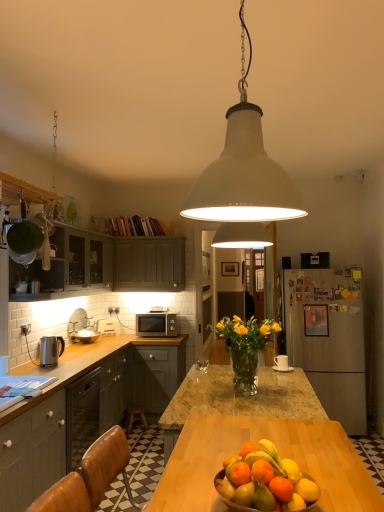
What is the approximate width of matte gray cabinets at left, which is the first cabinetry in bottom-to-top order?

25.11 inches.

This screenshot has width=384, height=512. What do you see at coordinates (32, 453) in the screenshot?
I see `matte gray cabinets at left, the fourth cabinetry positioned from the top` at bounding box center [32, 453].

Describe the element at coordinates (149, 264) in the screenshot. I see `matte gray cabinet at center, the second cabinetry when ordered from top to bottom` at that location.

Where is `orange matte citrus at center, which is counted as the 1th citrus fruit, starting from the back`? orange matte citrus at center, which is counted as the 1th citrus fruit, starting from the back is located at coordinates (291, 470).

What do you see at coordinates (135, 416) in the screenshot? I see `wooden stool at lower center` at bounding box center [135, 416].

Where is `matte gray cabinets at left, the fourth cabinetry positioned from the top`? Image resolution: width=384 pixels, height=512 pixels. matte gray cabinets at left, the fourth cabinetry positioned from the top is located at coordinates (32, 453).

Who is smaller, polished stainless steel kettle at left, acting as the first appliance starting from the front, or matte gray cabinet at center, acting as the 3th cabinetry starting from the bottom?

polished stainless steel kettle at left, acting as the first appliance starting from the front, is smaller.

Between polished stainless steel kettle at left, placed as the second appliance when sorted from back to front, and matte gray cabinet at center, acting as the 3th cabinetry starting from the bottom, which one appears on the left side from the viewer's perspective?

polished stainless steel kettle at left, placed as the second appliance when sorted from back to front.

Is matte gray cabinet at center, acting as the 3th cabinetry starting from the bottom, a part of polished stainless steel kettle at left, placed as the second appliance when sorted from back to front?

No, matte gray cabinet at center, acting as the 3th cabinetry starting from the bottom, is not a part of polished stainless steel kettle at left, placed as the second appliance when sorted from back to front.

Does polished stainless steel kettle at left, acting as the first appliance starting from the front, have a greater width compared to matte gray cabinet at center, the second cabinetry when ordered from top to bottom?

In fact, polished stainless steel kettle at left, acting as the first appliance starting from the front, might be narrower than matte gray cabinet at center, the second cabinetry when ordered from top to bottom.

Considering the relative sizes of satin grey cabinets at left, which is the second cabinetry in bottom-to-top order, and polished stainless steel kettle at left, placed as the second appliance when sorted from back to front, in the image provided, is satin grey cabinets at left, which is the second cabinetry in bottom-to-top order, shorter than polished stainless steel kettle at left, placed as the second appliance when sorted from back to front,?

Incorrect, the height of satin grey cabinets at left, which is the second cabinetry in bottom-to-top order, does not fall short of that of polished stainless steel kettle at left, placed as the second appliance when sorted from back to front.

From a real-world perspective, is satin grey cabinets at left, marked as the third cabinetry in a top-to-bottom arrangement, under polished stainless steel kettle at left, acting as the first appliance starting from the front?

Yes, from a real-world perspective, satin grey cabinets at left, marked as the third cabinetry in a top-to-bottom arrangement, is beneath polished stainless steel kettle at left, acting as the first appliance starting from the front.

Could you measure the distance between satin grey cabinets at left, which is the second cabinetry in bottom-to-top order, and polished stainless steel kettle at left, acting as the first appliance starting from the front?

The distance of satin grey cabinets at left, which is the second cabinetry in bottom-to-top order, from polished stainless steel kettle at left, acting as the first appliance starting from the front, is 66.73 centimeters.

Considering the sizes of objects satin grey cabinets at left, which is the second cabinetry in bottom-to-top order, and polished stainless steel kettle at left, placed as the second appliance when sorted from back to front, in the image provided, who is thinner, satin grey cabinets at left, which is the second cabinetry in bottom-to-top order, or polished stainless steel kettle at left, placed as the second appliance when sorted from back to front,?

With smaller width is polished stainless steel kettle at left, placed as the second appliance when sorted from back to front.

Is polished stainless steel kettle at left, acting as the first appliance starting from the front, facing away from orange matte citrus at center, the second citrus fruit when ordered from front to back?

No, polished stainless steel kettle at left, acting as the first appliance starting from the front, is not facing the opposite direction of orange matte citrus at center, the second citrus fruit when ordered from front to back.

Is polished stainless steel kettle at left, placed as the second appliance when sorted from back to front, to the left or to the right of orange matte citrus at center, which is counted as the 1th citrus fruit, starting from the back, in the image?

Based on their positions, polished stainless steel kettle at left, placed as the second appliance when sorted from back to front, is located to the left of orange matte citrus at center, which is counted as the 1th citrus fruit, starting from the back.

In the image, is polished stainless steel kettle at left, acting as the first appliance starting from the front, positioned in front of or behind orange matte citrus at center, placed as the 2th citrus fruit when sorted from left to right?

In the image, polished stainless steel kettle at left, acting as the first appliance starting from the front, appears behind orange matte citrus at center, placed as the 2th citrus fruit when sorted from left to right.

Is white plastic toaster at center, positioned as the second appliance in front-to-back order, at the back of orange matte citrus at center, the first citrus fruit in the right-to-left sequence?

orange matte citrus at center, the first citrus fruit in the right-to-left sequence, is not turned away from white plastic toaster at center, positioned as the second appliance in front-to-back order.

Who is smaller, orange matte citrus at center, which is counted as the 1th citrus fruit, starting from the back, or white plastic toaster at center, the first appliance when ordered from back to front?

With smaller size is orange matte citrus at center, which is counted as the 1th citrus fruit, starting from the back.

How different are the orientations of orange matte citrus at center, the first citrus fruit in the right-to-left sequence, and white plastic toaster at center, the first appliance when ordered from back to front, in degrees?

122 degrees separate the facing orientations of orange matte citrus at center, the first citrus fruit in the right-to-left sequence, and white plastic toaster at center, the first appliance when ordered from back to front.

Is white matte pendant light at center outside of translucent glass vase at center?

Yes, white matte pendant light at center is located beyond the bounds of translucent glass vase at center.

From the image's perspective, is white matte pendant light at center above or below translucent glass vase at center?

Based on their image positions, white matte pendant light at center is located above translucent glass vase at center.

From a real-world perspective, between white matte pendant light at center and translucent glass vase at center, who is vertically lower?

translucent glass vase at center.

Based on the photo, how distant is white matte pendant light at center from translucent glass vase at center?

A distance of 1.28 meters exists between white matte pendant light at center and translucent glass vase at center.

From their relative heights in the image, would you say translucent glass vase at center is taller or shorter than matte gray cabinets at left, the fourth cabinetry positioned from the top?

Clearly, translucent glass vase at center is shorter compared to matte gray cabinets at left, the fourth cabinetry positioned from the top.

In terms of size, does translucent glass vase at center appear bigger or smaller than matte gray cabinets at left, the fourth cabinetry positioned from the top?

In the image, translucent glass vase at center appears to be smaller than matte gray cabinets at left, the fourth cabinetry positioned from the top.

Considering their positions, is translucent glass vase at center located in front of or behind matte gray cabinets at left, the fourth cabinetry positioned from the top?

translucent glass vase at center is in front of matte gray cabinets at left, the fourth cabinetry positioned from the top.

Does translucent glass vase at center touch matte gray cabinets at left, the fourth cabinetry positioned from the top?

No, translucent glass vase at center is not next to matte gray cabinets at left, the fourth cabinetry positioned from the top.

In terms of width, does white plastic toaster at center, positioned as the second appliance in front-to-back order, look wider or thinner when compared to orange matte citrus at center, placed as the 2th citrus fruit when sorted from left to right?

Considering their sizes, white plastic toaster at center, positioned as the second appliance in front-to-back order, looks broader than orange matte citrus at center, placed as the 2th citrus fruit when sorted from left to right.

From the image's perspective, which is above, white plastic toaster at center, the first appliance when ordered from back to front, or orange matte citrus at center, the first citrus fruit in the right-to-left sequence?

orange matte citrus at center, the first citrus fruit in the right-to-left sequence, from the image's perspective.

Which is behind, point (118, 327) or point (285, 465)?

The point (118, 327) is more distant.

You are a GUI agent. You are given a task and a screenshot of the screen. Output one action in this format:
    pyautogui.click(x=<x>, y=<y>)
    Task: Click on the appliance that is the 1st one below the matte gray cabinet at center, the second cabinetry when ordered from top to bottom (from a real-world perspective)
    This screenshot has height=512, width=384.
    Given the screenshot: What is the action you would take?
    pyautogui.click(x=50, y=350)

Where is `the 1st cabinetry behind the polished stainless steel kettle at left, placed as the second appliance when sorted from back to front, counting from the anchor's position`? The image size is (384, 512). the 1st cabinetry behind the polished stainless steel kettle at left, placed as the second appliance when sorted from back to front, counting from the anchor's position is located at coordinates (94, 406).

Considering their positions, is matte gray cabinets at upper left, the first cabinetry in the top-to-bottom sequence, positioned closer to translucent glass vase at center than orange matte citrus at center, placed as the 2th citrus fruit when sorted from right to left?

orange matte citrus at center, placed as the 2th citrus fruit when sorted from right to left, is positioned closer to the anchor translucent glass vase at center.

Which object lies further to the anchor point satin silver microwave at center, white matte pendant light at center or white plastic toaster at center, the first appliance when ordered from back to front?

The object further to satin silver microwave at center is white matte pendant light at center.

Estimate the real-world distances between objects in this image. Which object is closer to polished stainless steel kettle at left, acting as the first appliance starting from the front, matte gray cabinets at upper left, the first cabinetry in the top-to-bottom sequence, or wooden stool at lower center?

matte gray cabinets at upper left, the first cabinetry in the top-to-bottom sequence, lies closer to polished stainless steel kettle at left, acting as the first appliance starting from the front, than the other object.

From the picture: Based on their spatial positions, is orange matte citrus at center, the 2th citrus fruit in the back-to-front sequence, or matte gray cabinet at center, acting as the 3th cabinetry starting from the bottom, closer to wooden stool at lower center?

Based on the image, matte gray cabinet at center, acting as the 3th cabinetry starting from the bottom, appears to be nearer to wooden stool at lower center.

Which object lies nearer to the anchor point orange matte citrus at center, which is counted as the 1th citrus fruit, starting from the back, translucent glass vase at center or polished stainless steel kettle at left, acting as the first appliance starting from the front?

translucent glass vase at center is positioned closer to the anchor orange matte citrus at center, which is counted as the 1th citrus fruit, starting from the back.

Based on their spatial positions, is matte gray cabinets at upper left, the fourth cabinetry positioned from the bottom, or orange matte citrus at center, marked as the 1th citrus fruit in a front-to-back arrangement, closer to orange matte citrus at center, placed as the 2th citrus fruit when sorted from left to right?

Among the two, orange matte citrus at center, marked as the 1th citrus fruit in a front-to-back arrangement, is located nearer to orange matte citrus at center, placed as the 2th citrus fruit when sorted from left to right.

Which object lies further to the anchor point white plastic toaster at center, the first appliance when ordered from back to front, orange matte citrus at center, marked as the 1th citrus fruit in a front-to-back arrangement, or orange matte citrus at center, the second citrus fruit when ordered from front to back?

Based on the image, orange matte citrus at center, marked as the 1th citrus fruit in a front-to-back arrangement, appears to be further to white plastic toaster at center, the first appliance when ordered from back to front.

Which object lies further to the anchor point white matte pendant light at center, translucent glass vase at center or white plastic toaster at center, positioned as the second appliance in front-to-back order?

The object further to white matte pendant light at center is white plastic toaster at center, positioned as the second appliance in front-to-back order.

Image resolution: width=384 pixels, height=512 pixels. Identify the location of microwave oven between orange matte citrus at center, which is counted as the 1th citrus fruit, starting from the back, and white plastic toaster at center, the first appliance when ordered from back to front, along the z-axis. (157, 324).

You are a GUI agent. You are given a task and a screenshot of the screen. Output one action in this format:
    pyautogui.click(x=<x>, y=<y>)
    Task: Click on the appliance between translucent glass vase at center and matte gray cabinet at center, the second cabinetry when ordered from top to bottom, in the front-back direction
    
    Given the screenshot: What is the action you would take?
    pyautogui.click(x=50, y=350)

At what (x,y) coordinates should I click in order to perform the action: click on floral arrangement between orange matte citrus at center, the 1th citrus fruit when ordered from left to right, and matte gray cabinet at center, acting as the 3th cabinetry starting from the bottom, from front to back. Please return your answer as a coordinate pair (x, y). The width and height of the screenshot is (384, 512). Looking at the image, I should click on click(245, 348).

I want to click on appliance located between white matte pendant light at center and satin grey cabinets at left, marked as the third cabinetry in a top-to-bottom arrangement, in the depth direction, so click(x=50, y=350).